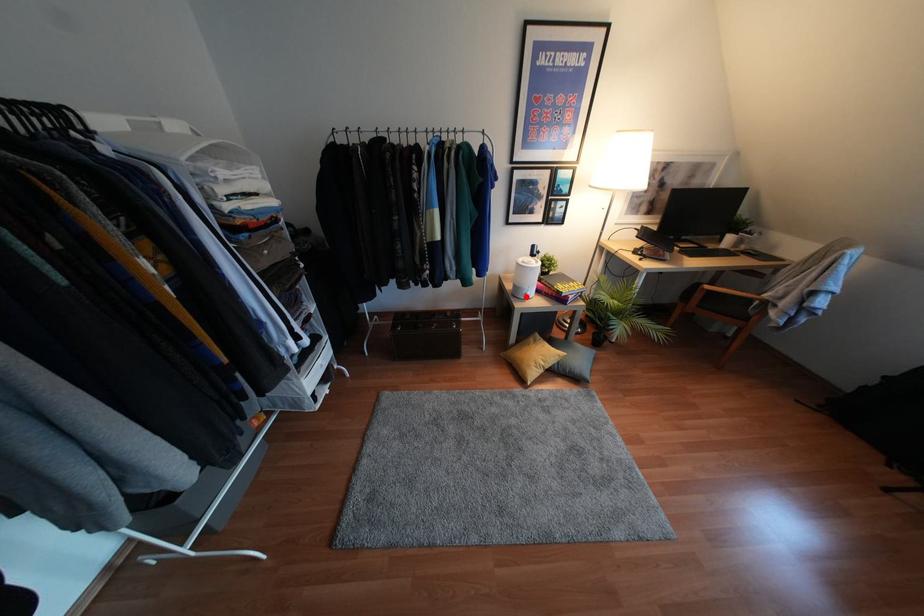
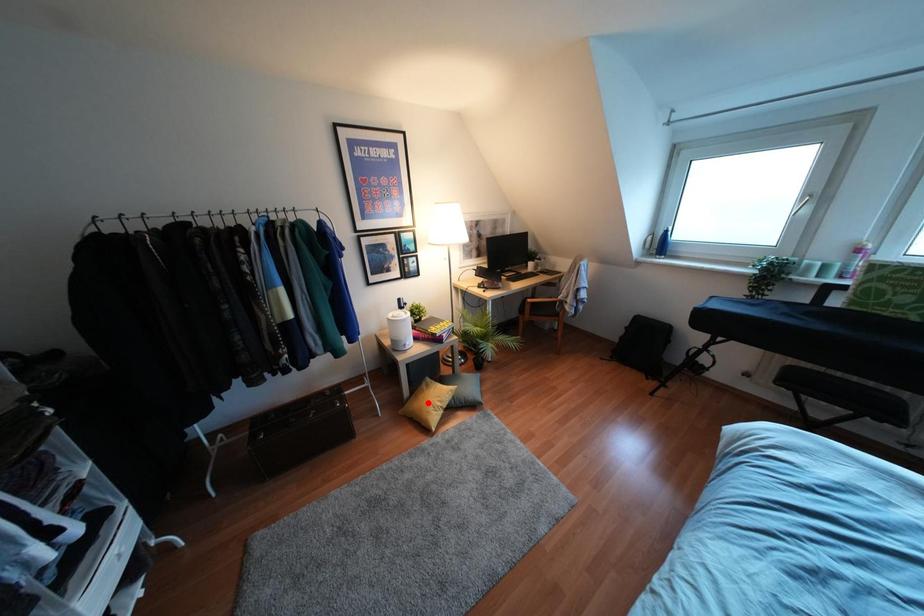
I am providing you with two images of the same scene from different viewpoints. A red point is marked on the first image and another point is marked on the second image. Is the red point in image1 aligned with the point shown in image2?

No